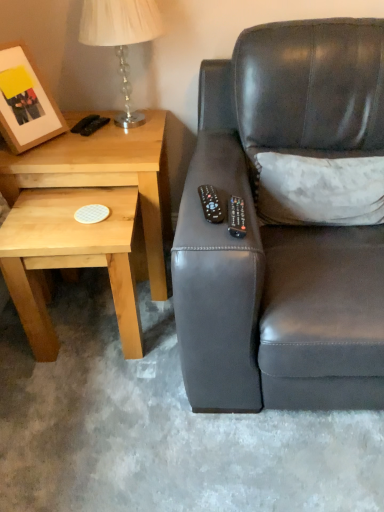
Locate an element on the screen. The image size is (384, 512). free spot in front of wooden matte picture frame at upper left is located at coordinates (33, 161).